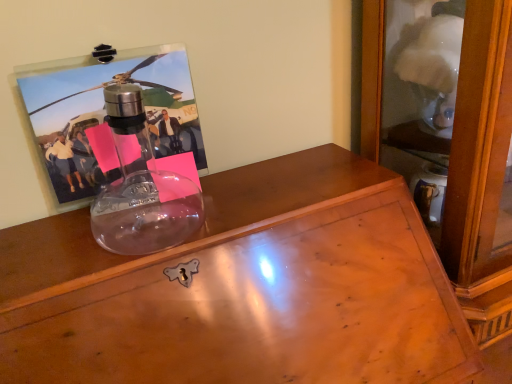
Image resolution: width=512 pixels, height=384 pixels. In order to click on unoccupied region to the right of clear plastic frame at upper left in this screenshot , I will do `click(225, 200)`.